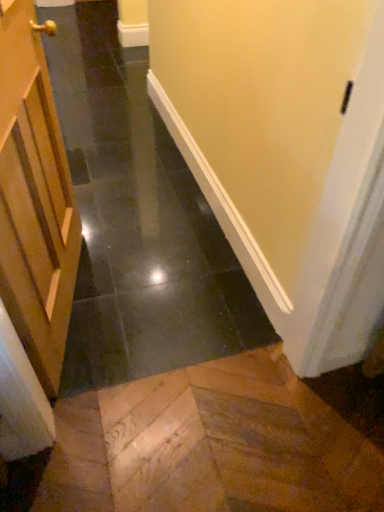
Question: Considering the positions of wooden door at left and black glossy tile at center in the image, is wooden door at left bigger or smaller than black glossy tile at center?

Choices:
 (A) small
 (B) big

Answer: (A)

Question: Is wooden door at left to the left or to the right of black glossy tile at center in the image?

Choices:
 (A) right
 (B) left

Answer: (B)

Question: Is wooden door at left in front of or behind black glossy tile at center in the image?

Choices:
 (A) front
 (B) behind

Answer: (B)

Question: From a real-world perspective, is black glossy tile at center above or below wooden door at left?

Choices:
 (A) below
 (B) above

Answer: (B)

Question: Is black glossy tile at center taller or shorter than wooden door at left?

Choices:
 (A) tall
 (B) short

Answer: (A)

Question: Based on their sizes in the image, would you say black glossy tile at center is bigger or smaller than wooden door at left?

Choices:
 (A) big
 (B) small

Answer: (A)

Question: Considering the positions of black glossy tile at center and wooden door at left in the image, is black glossy tile at center wider or thinner than wooden door at left?

Choices:
 (A) wide
 (B) thin

Answer: (A)